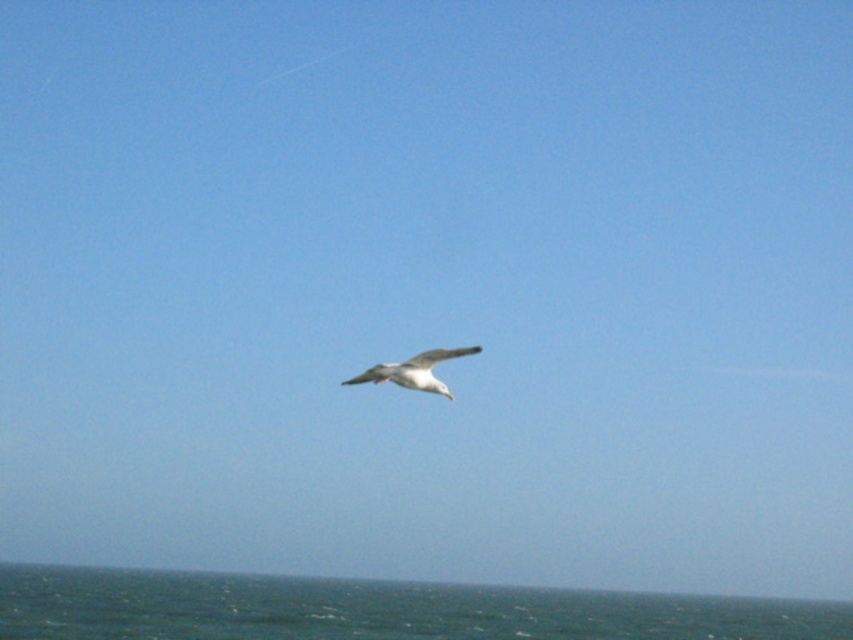
Question: Which object appears farthest from the camera in this image?

Choices:
 (A) white feathered bird at center
 (B) greenish-blue water at lower center

Answer: (B)

Question: From the image, what is the correct spatial relationship of greenish-blue water at lower center in relation to white feathered bird at center?

Choices:
 (A) below
 (B) above

Answer: (A)

Question: Which of the following is the closest to the observer?

Choices:
 (A) (428, 380)
 (B) (665, 600)

Answer: (A)

Question: Is greenish-blue water at lower center in front of white feathered bird at center?

Choices:
 (A) yes
 (B) no

Answer: (B)

Question: Does greenish-blue water at lower center lie in front of white feathered bird at center?

Choices:
 (A) no
 (B) yes

Answer: (A)